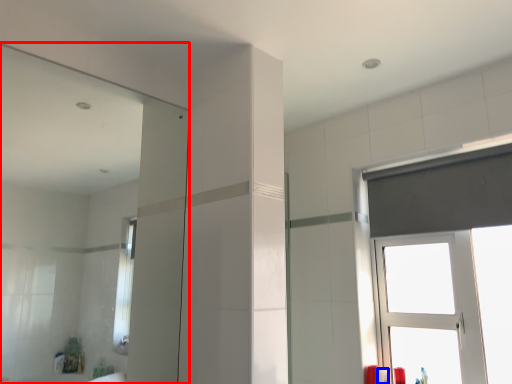
Question: Which point is further to the camera, mirror (highlighted by a red box) or toiletry (highlighted by a blue box)?

Choices:
 (A) mirror
 (B) toiletry

Answer: (B)